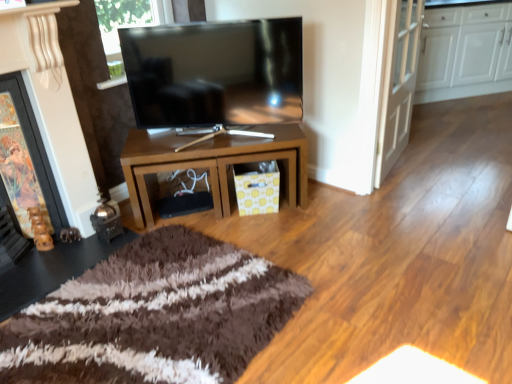
Identify the location of vacant space to the right of brown glossy table at center. (338, 221).